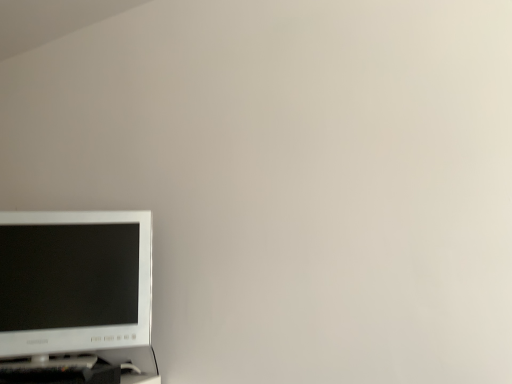
Question: Can you confirm if white glossy computer monitor at lower left is thinner than black plastic computer desk at lower left?

Choices:
 (A) yes
 (B) no

Answer: (A)

Question: Considering the relative sizes of white glossy computer monitor at lower left and black plastic computer desk at lower left in the image provided, is white glossy computer monitor at lower left taller than black plastic computer desk at lower left?

Choices:
 (A) no
 (B) yes

Answer: (B)

Question: From a real-world perspective, is white glossy computer monitor at lower left physically below black plastic computer desk at lower left?

Choices:
 (A) yes
 (B) no

Answer: (B)

Question: From the image's perspective, is white glossy computer monitor at lower left over black plastic computer desk at lower left?

Choices:
 (A) no
 (B) yes

Answer: (B)

Question: Is white glossy computer monitor at lower left wider than black plastic computer desk at lower left?

Choices:
 (A) no
 (B) yes

Answer: (A)

Question: Considering the relative sizes of white glossy computer monitor at lower left and black plastic computer desk at lower left in the image provided, is white glossy computer monitor at lower left bigger than black plastic computer desk at lower left?

Choices:
 (A) yes
 (B) no

Answer: (A)

Question: Is black plastic computer desk at lower left not within white glossy computer monitor at lower left?

Choices:
 (A) no
 (B) yes

Answer: (B)

Question: Considering the relative sizes of black plastic computer desk at lower left and white glossy computer monitor at lower left in the image provided, is black plastic computer desk at lower left shorter than white glossy computer monitor at lower left?

Choices:
 (A) no
 (B) yes

Answer: (B)

Question: Does black plastic computer desk at lower left have a larger size compared to white glossy computer monitor at lower left?

Choices:
 (A) yes
 (B) no

Answer: (B)

Question: Is black plastic computer desk at lower left with white glossy computer monitor at lower left?

Choices:
 (A) yes
 (B) no

Answer: (B)

Question: Does black plastic computer desk at lower left have a lesser width compared to white glossy computer monitor at lower left?

Choices:
 (A) no
 (B) yes

Answer: (A)

Question: Does black plastic computer desk at lower left have a smaller size compared to white glossy computer monitor at lower left?

Choices:
 (A) yes
 (B) no

Answer: (A)

Question: From the image's perspective, is black plastic computer desk at lower left above or below white glossy computer monitor at lower left?

Choices:
 (A) above
 (B) below

Answer: (B)